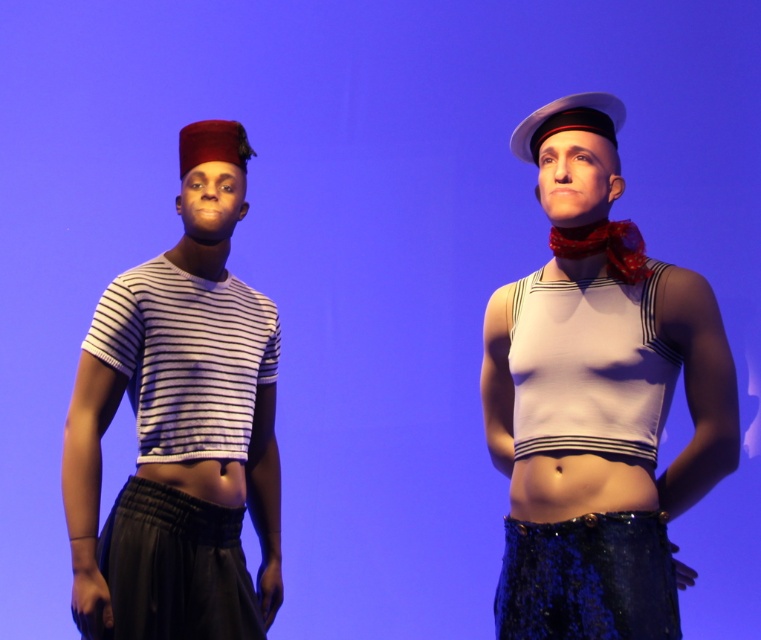
Is the position of white matte sailor top at center less distant than that of matte striped shirt at left?

Yes, it is in front of matte striped shirt at left.

Is white matte sailor top at center thinner than matte striped shirt at left?

No, white matte sailor top at center is not thinner than matte striped shirt at left.

Which is behind, point (600, 129) or point (237, 353)?

Point (237, 353)

Find the location of `white matte sailor top at center`. white matte sailor top at center is located at coordinates (597, 397).

Between white matte sailor top at center and white striped fabric shirt at left, which one is positioned higher?

white striped fabric shirt at left

Identify the location of white matte sailor top at center. Image resolution: width=761 pixels, height=640 pixels. (597, 397).

At what (x,y) coordinates should I click in order to perform the action: click on white matte sailor top at center. Please return your answer as a coordinate pair (x, y). This screenshot has width=761, height=640. Looking at the image, I should click on (597, 397).

Is matte striped shirt at left thinner than white striped fabric shirt at left?

No, matte striped shirt at left is not thinner than white striped fabric shirt at left.

Between point (205, 122) and point (169, 317), which one is positioned behind?

Positioned behind is point (205, 122).

Identify the location of matte striped shirt at left. Image resolution: width=761 pixels, height=640 pixels. (180, 426).